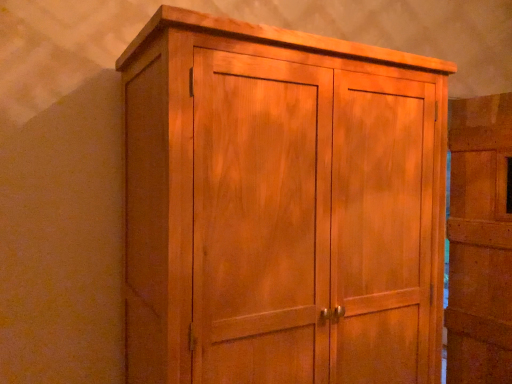
Where is `light brown wood cupboard at center`? This screenshot has width=512, height=384. light brown wood cupboard at center is located at coordinates (280, 206).

What do you see at coordinates (280, 206) in the screenshot? I see `light brown wood cupboard at center` at bounding box center [280, 206].

Based on the photo, in order to face light brown wood cupboard at center, should I rotate leftwards or rightwards?

Rotate your view right by about 3.648°.

Consider the image. In order to face matte wood door at right, should I rotate leftwards or rightwards?

You should look right and rotate roughly 28.149 degrees.

Describe the element at coordinates (480, 241) in the screenshot. The width and height of the screenshot is (512, 384). I see `matte wood door at right` at that location.

Identify the location of matte wood door at right. The width and height of the screenshot is (512, 384). (480, 241).

The image size is (512, 384). What are the coordinates of `light brown wood cupboard at center` in the screenshot? It's located at (280, 206).

Considering the relative positions of matte wood door at right and light brown wood cupboard at center in the image provided, is matte wood door at right to the left of light brown wood cupboard at center from the viewer's perspective?

No.

Is matte wood door at right in front of or behind light brown wood cupboard at center in the image?

Clearly, matte wood door at right is behind light brown wood cupboard at center.

Which is in front, point (502, 344) or point (268, 33)?

The point (268, 33) is more forward.

From the image's perspective, is matte wood door at right beneath light brown wood cupboard at center?

Indeed, from the image's perspective, matte wood door at right is shown beneath light brown wood cupboard at center.

From a real-world perspective, which is physically below, matte wood door at right or light brown wood cupboard at center?

From a 3D spatial view, matte wood door at right is below.

Which of these two, matte wood door at right or light brown wood cupboard at center, is wider?

light brown wood cupboard at center is wider.

Considering the relative sizes of matte wood door at right and light brown wood cupboard at center in the image provided, is matte wood door at right taller than light brown wood cupboard at center?

Yes.

Considering the relative sizes of matte wood door at right and light brown wood cupboard at center in the image provided, is matte wood door at right smaller than light brown wood cupboard at center?

Correct, matte wood door at right occupies less space than light brown wood cupboard at center.

Can we say matte wood door at right lies outside light brown wood cupboard at center?

Yes, matte wood door at right is located beyond the bounds of light brown wood cupboard at center.

Is there a large distance between matte wood door at right and light brown wood cupboard at center?

matte wood door at right is positioned a significant distance from light brown wood cupboard at center.

Is matte wood door at right positioned with its back to light brown wood cupboard at center?

No, matte wood door at right's orientation is not away from light brown wood cupboard at center.

How many degrees apart are the facing directions of matte wood door at right and light brown wood cupboard at center?

The facing directions of matte wood door at right and light brown wood cupboard at center are 81.9 degrees apart.

Identify the location of door located below the light brown wood cupboard at center (from the image's perspective). (480, 241).

Can you confirm if light brown wood cupboard at center is positioned to the left of matte wood door at right?

Indeed, light brown wood cupboard at center is positioned on the left side of matte wood door at right.

Relative to matte wood door at right, is light brown wood cupboard at center in front or behind?

Visually, light brown wood cupboard at center is located in front of matte wood door at right.

Considering the positions of points (135, 265) and (487, 276), is point (135, 265) closer to camera compared to point (487, 276)?

Yes, point (135, 265) is in front of point (487, 276).

From the image's perspective, who appears lower, light brown wood cupboard at center or matte wood door at right?

From the image's view, matte wood door at right is below.

From a real-world perspective, who is located higher, light brown wood cupboard at center or matte wood door at right?

From a 3D spatial view, light brown wood cupboard at center is above.

Is light brown wood cupboard at center wider or thinner than matte wood door at right?

Considering their sizes, light brown wood cupboard at center looks broader than matte wood door at right.

Considering the sizes of light brown wood cupboard at center and matte wood door at right in the image, is light brown wood cupboard at center taller or shorter than matte wood door at right?

Clearly, light brown wood cupboard at center is shorter compared to matte wood door at right.

Can you confirm if light brown wood cupboard at center is bigger than matte wood door at right?

Correct, light brown wood cupboard at center is larger in size than matte wood door at right.

From the picture: Is light brown wood cupboard at center located outside matte wood door at right?

Indeed, light brown wood cupboard at center is completely outside matte wood door at right.

From the picture: Is light brown wood cupboard at center far away from matte wood door at right?

light brown wood cupboard at center is positioned a significant distance from matte wood door at right.

Is light brown wood cupboard at center facing towards matte wood door at right?

No, light brown wood cupboard at center does not turn towards matte wood door at right.

What's the angular difference between light brown wood cupboard at center and matte wood door at right's facing directions?

81.9 degrees.

The height and width of the screenshot is (384, 512). I want to click on cupboard on the left of matte wood door at right, so click(280, 206).

The width and height of the screenshot is (512, 384). What are the coordinates of `cupboard above the matte wood door at right (from a real-world perspective)` in the screenshot? It's located at (280, 206).

You are a GUI agent. You are given a task and a screenshot of the screen. Output one action in this format:
    pyautogui.click(x=<x>, y=<y>)
    Task: Click on the door located on the right of light brown wood cupboard at center
    This screenshot has width=512, height=384.
    Given the screenshot: What is the action you would take?
    pyautogui.click(x=480, y=241)